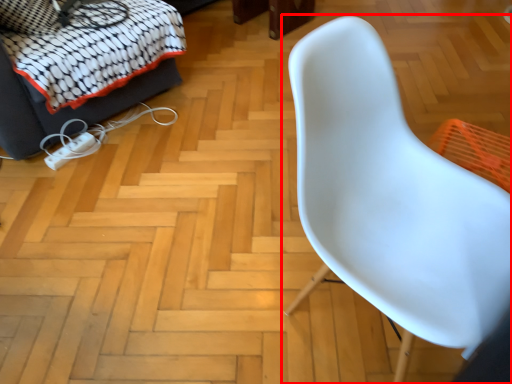
Question: From the image's perspective, where is chair (annotated by the red box) located relative to furniture?

Choices:
 (A) above
 (B) below

Answer: (B)